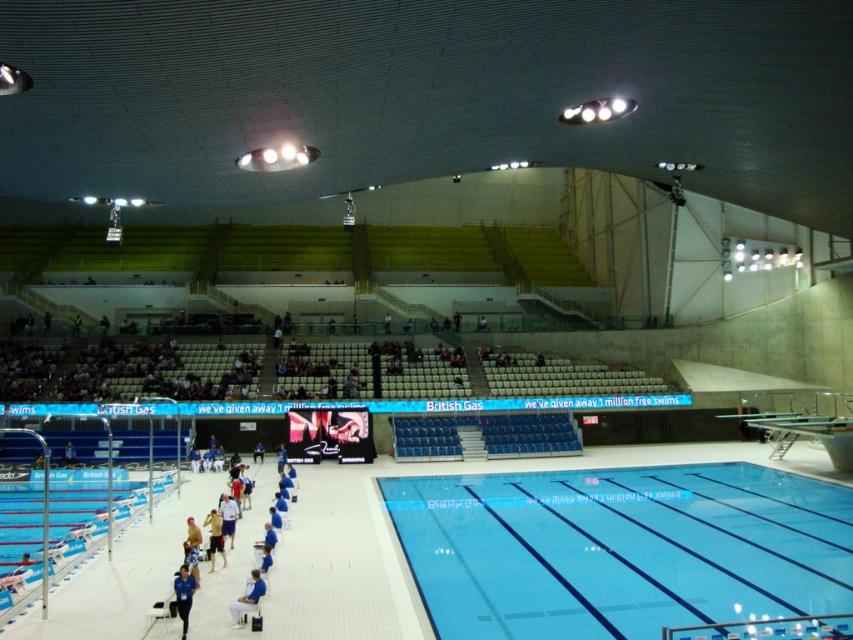
Is point (616, 477) positioned before point (206, 522)?

No, it is behind (206, 522).

Between clear blue water at center and light blue fabric shorts at center, which one has less height?

Standing shorter between the two is clear blue water at center.

The height and width of the screenshot is (640, 853). I want to click on clear blue water at center, so click(619, 548).

Does blue fabric chair at lower center appear on the right side of light blue fabric shirt at center?

Indeed, blue fabric chair at lower center is positioned on the right side of light blue fabric shirt at center.

Does blue fabric chair at lower center have a greater width compared to light blue fabric shirt at center?

Correct, the width of blue fabric chair at lower center exceeds that of light blue fabric shirt at center.

The height and width of the screenshot is (640, 853). What do you see at coordinates (247, 598) in the screenshot?
I see `blue fabric chair at lower center` at bounding box center [247, 598].

Locate an element on the screen. The width and height of the screenshot is (853, 640). blue fabric chair at lower center is located at coordinates (247, 598).

Does light blue fabric shorts at center appear over light blue fabric shirt at center?

No.

Does light blue fabric shorts at center have a larger size compared to light blue fabric shirt at center?

Yes.

The height and width of the screenshot is (640, 853). Identify the location of light blue fabric shorts at center. (213, 538).